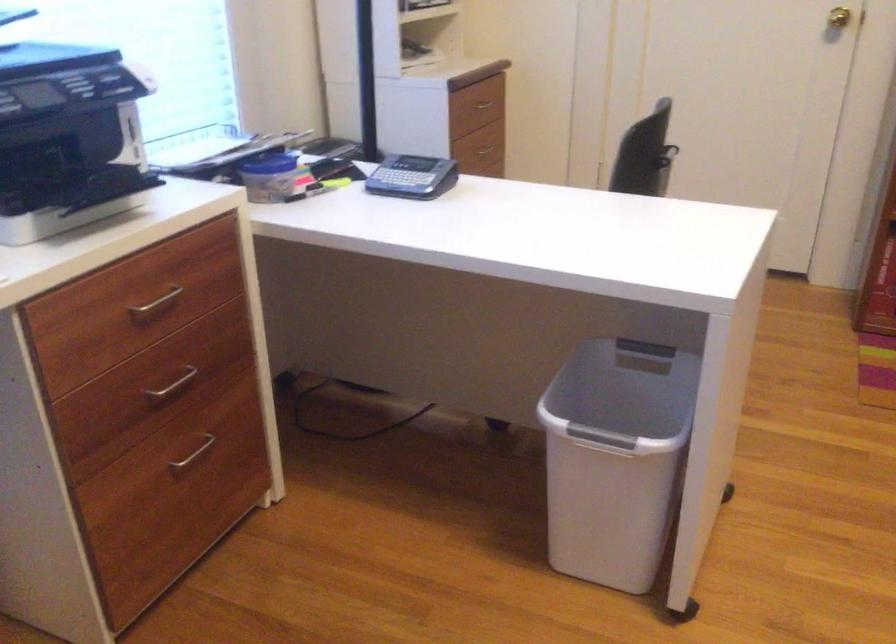
Where would you pull the brass doorknob? Please return your answer as a coordinate pair (x, y).

(839, 17)